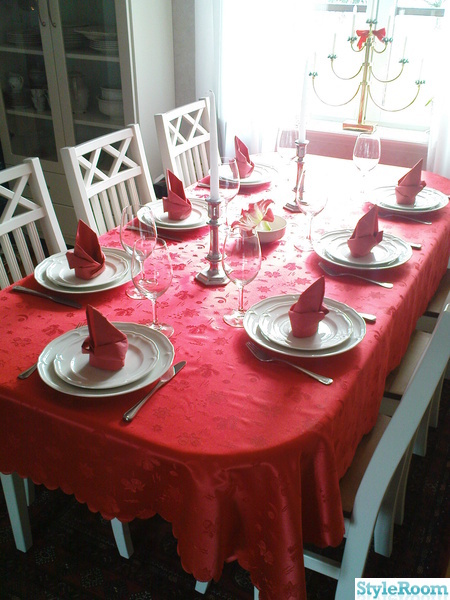
What are the coordinates of `7 plates` in the screenshot? It's located at (47, 381), (42, 279), (198, 226), (259, 183), (428, 208), (366, 268), (354, 331).